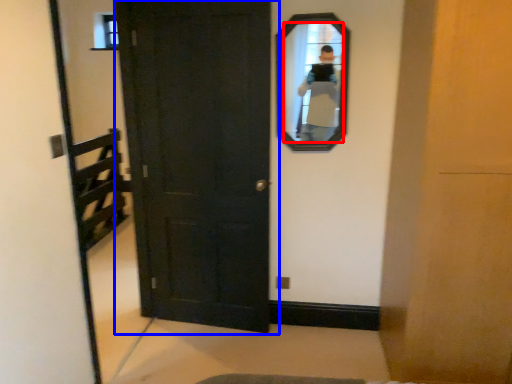
Question: Among these objects, which one is farthest to the camera, mirror (highlighted by a red box) or door (highlighted by a blue box)?

Choices:
 (A) mirror
 (B) door

Answer: (A)